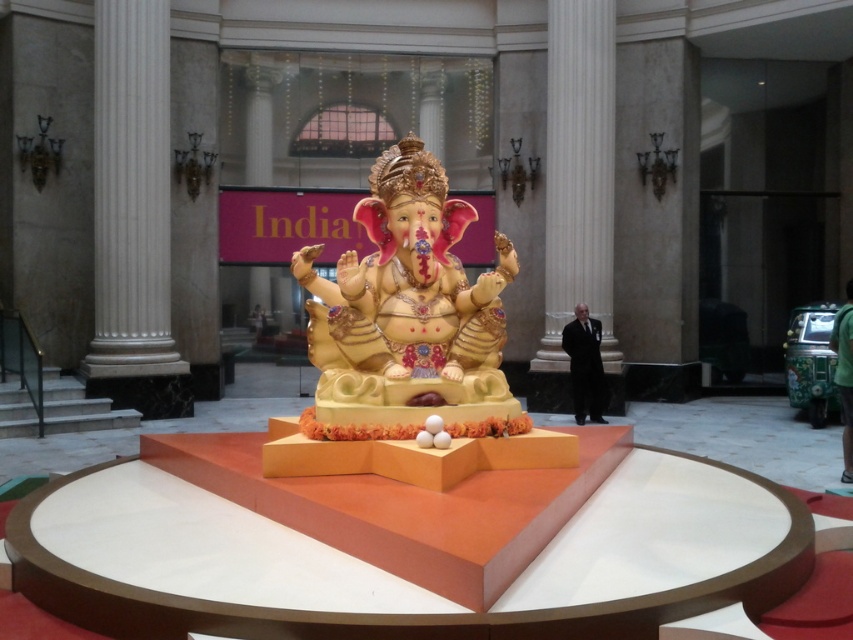
You are standing in the museum and want to take a photo of the statue. You notice two points marked in the image. Which point, point (392,433) or point (602,323), is closer to your camera lens?

Point (392,433) is closer to the camera than point (602,323).